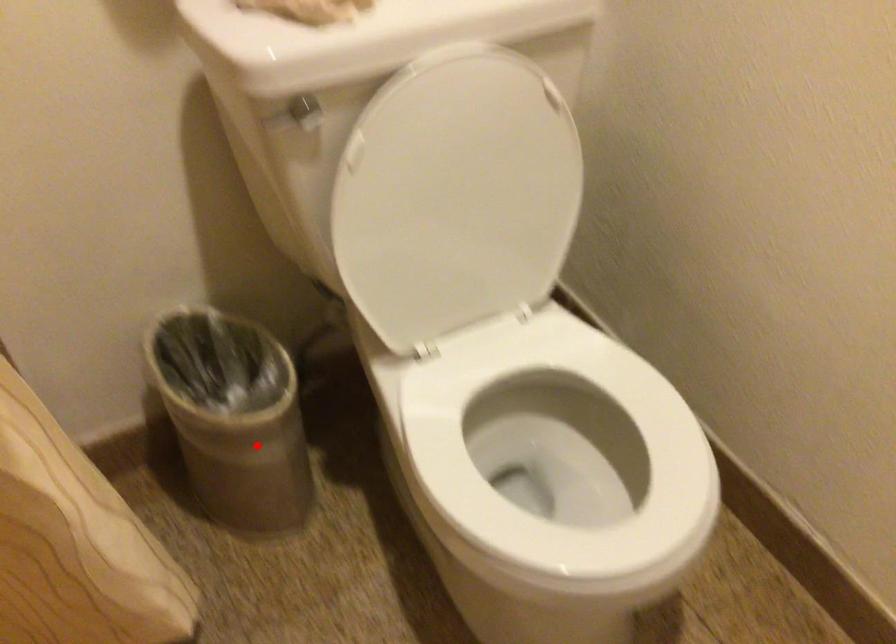
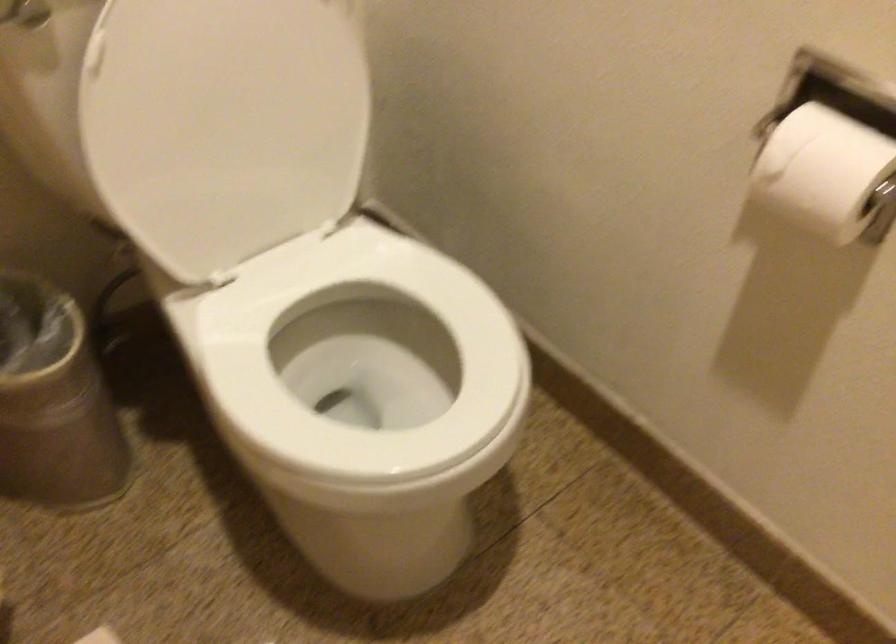
Where in the second image is the point corresponding to the highlighted location from the first image?

(54, 402)